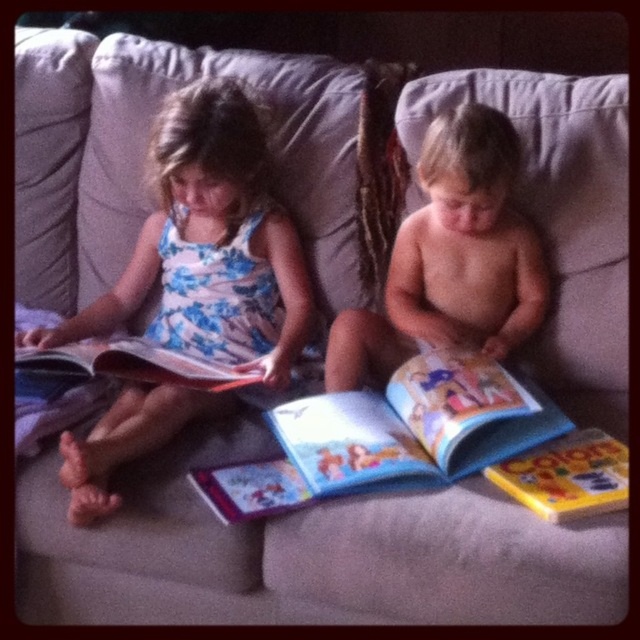
Question: Can you confirm if floral dress at left is bigger than hardcover book at center?

Choices:
 (A) no
 (B) yes

Answer: (B)

Question: Does floral dress at left have a smaller size compared to smooth skin baby at center?

Choices:
 (A) yes
 (B) no

Answer: (B)

Question: In this image, where is floral dress at left located relative to smooth skin baby at center?

Choices:
 (A) below
 (B) above

Answer: (A)

Question: Which object is farther from the camera taking this photo?

Choices:
 (A) hardcover book at center
 (B) smooth skin baby at center
 (C) floral dress at left

Answer: (B)

Question: Which of the following is the farthest from the observer?

Choices:
 (A) (86, 353)
 (B) (211, 100)
 (C) (451, 365)
 (D) (524, 256)

Answer: (D)

Question: Estimate the real-world distances between objects in this image. Which object is closer to the hardcover book at left?

Choices:
 (A) floral dress at left
 (B) hardcover book at center

Answer: (A)